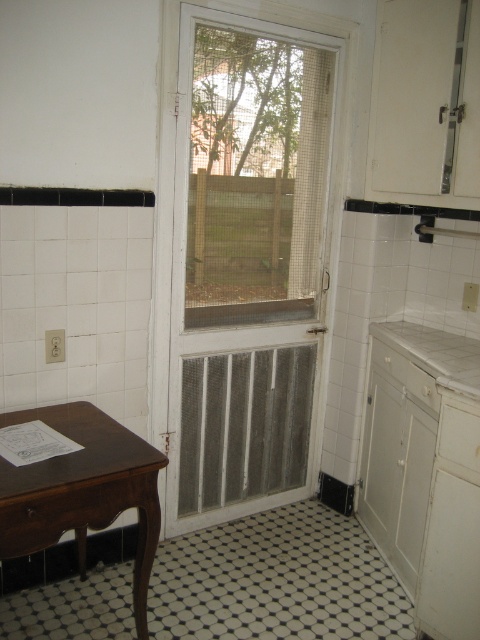
Does white mesh screen door at center appear over brown wood table at lower left?

Indeed, white mesh screen door at center is positioned over brown wood table at lower left.

Can you confirm if white mesh screen door at center is positioned below brown wood table at lower left?

Actually, white mesh screen door at center is above brown wood table at lower left.

Is point (186, 141) positioned after point (69, 525)?

That is True.

The height and width of the screenshot is (640, 480). Find the location of `white mesh screen door at center`. white mesh screen door at center is located at coordinates (241, 259).

Is point (310, 84) behind point (432, 355)?

Yes, it is behind point (432, 355).

Does point (313, 236) lie in front of point (415, 360)?

That is False.

Identify the location of clear glass door at center. This screenshot has height=640, width=480. (255, 177).

Between brown wood table at lower left and white laminate countertop at right, which one is positioned higher?

white laminate countertop at right is higher up.

Between brown wood table at lower left and white laminate countertop at right, which one appears on the left side from the viewer's perspective?

brown wood table at lower left

Describe the element at coordinates (83, 490) in the screenshot. I see `brown wood table at lower left` at that location.

This screenshot has width=480, height=640. Find the location of `brown wood table at lower left`. brown wood table at lower left is located at coordinates (83, 490).